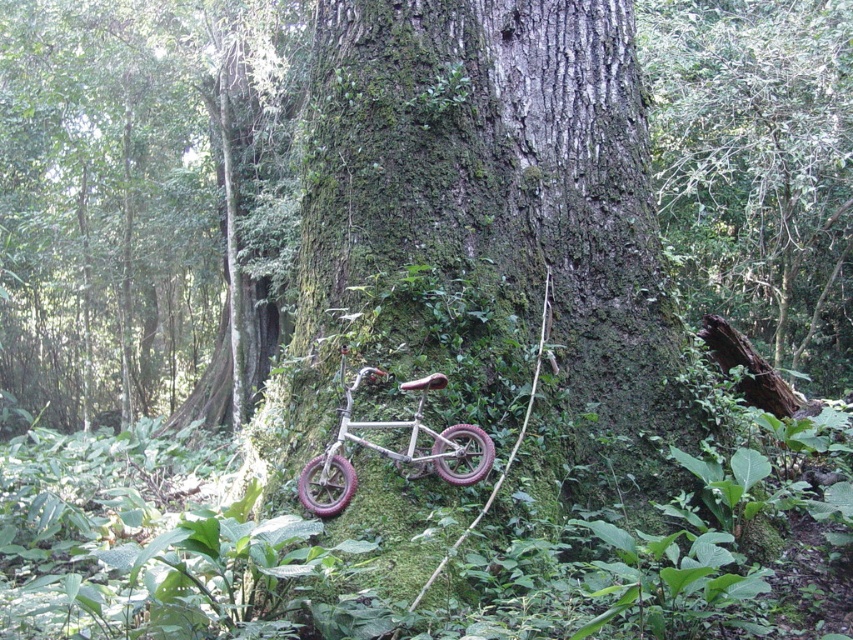
Is point (776, 13) in front of point (488, 467)?

No, it is behind (488, 467).

Does smooth bark tree at center have a smaller size compared to metallic matte bicycle at center?

No, smooth bark tree at center is not smaller than metallic matte bicycle at center.

Does point (819, 321) come in front of point (366, 371)?

No, (819, 321) is behind (366, 371).

Where is `smooth bark tree at center`? smooth bark tree at center is located at coordinates (757, 168).

From the picture: Between green mossy bark at center and metallic matte bicycle at center, which one appears on the right side from the viewer's perspective?

Positioned to the right is green mossy bark at center.

Which is in front, point (320, 144) or point (318, 458)?

Point (318, 458) is more forward.

Identify the location of green mossy bark at center. (489, 184).

Can you confirm if green mossy tree at center is smaller than smooth bark tree at center?

No, green mossy tree at center is not smaller than smooth bark tree at center.

Which is behind, point (86, 362) or point (846, 385)?

Point (86, 362)

The height and width of the screenshot is (640, 853). Identify the location of green mossy tree at center. (144, 202).